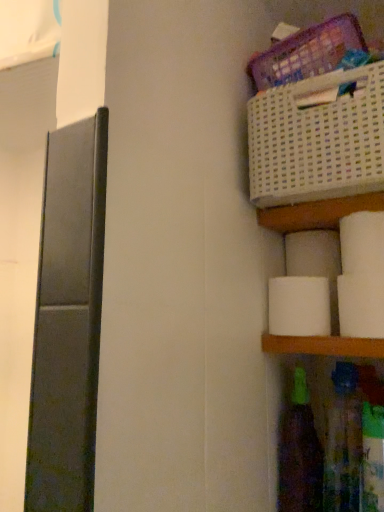
Image resolution: width=384 pixels, height=512 pixels. Describe the element at coordinates (299, 306) in the screenshot. I see `white matte toilet paper at right, marked as the 3th toilet paper in a front-to-back arrangement` at that location.

Locate an element on the screen. The image size is (384, 512). white matte toilet paper at right, the 4th toilet paper from the front is located at coordinates (313, 254).

Locate an element on the screen. This screenshot has height=512, width=384. white plastic basket at upper right is located at coordinates (317, 140).

What do you see at coordinates (317, 140) in the screenshot? I see `white plastic basket at upper right` at bounding box center [317, 140].

Find the location of a particular element. The height and width of the screenshot is (512, 384). translucent plastic bottle at lower right, which is the second bottle from right to left is located at coordinates (299, 452).

Between translucent plastic bottle at lower right, which is the second bottle from right to left, and white matte toilet paper at right, which is counted as the second toilet paper, starting from the back, which one has less height?

white matte toilet paper at right, which is counted as the second toilet paper, starting from the back, is shorter.

From a real-world perspective, which is physically below, translucent plastic bottle at lower right, which is the second bottle from right to left, or white matte toilet paper at right, which is counted as the second toilet paper, starting from the back?

translucent plastic bottle at lower right, which is the second bottle from right to left, from a real-world perspective.

Considering the positions of objects translucent plastic bottle at lower right, which is the second bottle from right to left, and white matte toilet paper at right, marked as the 3th toilet paper in a front-to-back arrangement, in the image provided, who is more to the left, translucent plastic bottle at lower right, which is the second bottle from right to left, or white matte toilet paper at right, marked as the 3th toilet paper in a front-to-back arrangement,?

white matte toilet paper at right, marked as the 3th toilet paper in a front-to-back arrangement.

Is translucent plastic bottle at lower right, which is the second bottle from right to left, positioned with its back to white matte toilet paper at right, which is counted as the second toilet paper, starting from the back?

No, translucent plastic bottle at lower right, which is the second bottle from right to left, is not facing away from white matte toilet paper at right, which is counted as the second toilet paper, starting from the back.

What's the angular difference between white matte toilet paper at lower right, arranged as the first toilet paper when viewed from the front, and translucent plastic bottle at lower right, the first bottle from the right,'s facing directions?

There is a 0.00146-degree angle between the facing directions of white matte toilet paper at lower right, arranged as the first toilet paper when viewed from the front, and translucent plastic bottle at lower right, the first bottle from the right.

Is white matte toilet paper at lower right, the fourth toilet paper positioned from the back, further to camera compared to translucent plastic bottle at lower right, which appears as the 2th bottle when viewed from the left?

No, the depth of white matte toilet paper at lower right, the fourth toilet paper positioned from the back, is less than that of translucent plastic bottle at lower right, which appears as the 2th bottle when viewed from the left.

From the image's perspective, which object appears higher, white matte toilet paper at lower right, arranged as the first toilet paper when viewed from the front, or translucent plastic bottle at lower right, which appears as the 2th bottle when viewed from the left?

From the image's view, white matte toilet paper at lower right, arranged as the first toilet paper when viewed from the front, is above.

Is the surface of white matte toilet paper at lower right, the fourth toilet paper positioned from the back, in direct contact with translucent plastic bottle at lower right, which appears as the 2th bottle when viewed from the left?

No.

Is white matte toilet paper at right, which is the 3th toilet paper from back to front, positioned beyond the bounds of white matte toilet paper at lower right, arranged as the first toilet paper when viewed from the front?

white matte toilet paper at right, which is the 3th toilet paper from back to front, is positioned outside white matte toilet paper at lower right, arranged as the first toilet paper when viewed from the front.

From a real-world perspective, who is located lower, white matte toilet paper at right, which is counted as the 2th toilet paper, starting from the front, or white matte toilet paper at lower right, arranged as the first toilet paper when viewed from the front?

white matte toilet paper at lower right, arranged as the first toilet paper when viewed from the front.

Does white matte toilet paper at right, which is the 3th toilet paper from back to front, lie behind white matte toilet paper at lower right, the fourth toilet paper positioned from the back?

That is True.

Can you tell me how much white matte toilet paper at right, the 4th toilet paper from the front, and white matte toilet paper at right, marked as the 3th toilet paper in a front-to-back arrangement, differ in facing direction?

white matte toilet paper at right, the 4th toilet paper from the front, and white matte toilet paper at right, marked as the 3th toilet paper in a front-to-back arrangement, are facing 0.000574 degrees away from each other.

From a real-world perspective, is white matte toilet paper at right, the 4th toilet paper from the front, on top of white matte toilet paper at right, which is counted as the second toilet paper, starting from the back?

Yes, from a real-world perspective, white matte toilet paper at right, the 4th toilet paper from the front, is over white matte toilet paper at right, which is counted as the second toilet paper, starting from the back

Is white matte toilet paper at right, marked as the 3th toilet paper in a front-to-back arrangement, a part of white matte toilet paper at right, the 4th toilet paper from the front?

No, white matte toilet paper at right, marked as the 3th toilet paper in a front-to-back arrangement, is not surrounded by white matte toilet paper at right, the 4th toilet paper from the front.

Which object is wider, white matte toilet paper at right, which ranks as the first toilet paper in back-to-front order, or white matte toilet paper at right, which is counted as the second toilet paper, starting from the back?

Wider between the two is white matte toilet paper at right, which ranks as the first toilet paper in back-to-front order.

Does white matte toilet paper at right, which is counted as the second toilet paper, starting from the back, appear on the left side of translucent plastic bottle at lower right, which appears as the 2th bottle when viewed from the left?

Answer: Yes, white matte toilet paper at right, which is counted as the second toilet paper, starting from the back, is to the left of translucent plastic bottle at lower right, which appears as the 2th bottle when viewed from the left.

Which is behind, white matte toilet paper at right, marked as the 3th toilet paper in a front-to-back arrangement, or translucent plastic bottle at lower right, which appears as the 2th bottle when viewed from the left?

white matte toilet paper at right, marked as the 3th toilet paper in a front-to-back arrangement, is more distant.

From a real-world perspective, is white matte toilet paper at right, which is counted as the second toilet paper, starting from the back, positioned above or below translucent plastic bottle at lower right, the first bottle from the right?

white matte toilet paper at right, which is counted as the second toilet paper, starting from the back, is situated higher than translucent plastic bottle at lower right, the first bottle from the right, in the real world.

Which point is more distant from viewer, (277, 311) or (356, 482)?

Point (277, 311)

Is white plastic basket at upper right oriented towards translucent plastic bottle at lower right, the first bottle from the right?

No, white plastic basket at upper right is not turned towards translucent plastic bottle at lower right, the first bottle from the right.

Can you confirm if white plastic basket at upper right is shorter than translucent plastic bottle at lower right, the first bottle from the right?

Correct, white plastic basket at upper right is not as tall as translucent plastic bottle at lower right, the first bottle from the right.

Is white plastic basket at upper right positioned before translucent plastic bottle at lower right, the first bottle from the right?

Yes, white plastic basket at upper right is in front of translucent plastic bottle at lower right, the first bottle from the right.

Can you confirm if white plastic basket at upper right is positioned to the left of translucent plastic bottle at lower right, which appears as the 2th bottle when viewed from the left?

Yes, white plastic basket at upper right is to the left of translucent plastic bottle at lower right, which appears as the 2th bottle when viewed from the left.

Can you confirm if white matte toilet paper at right, which is counted as the second toilet paper, starting from the back, is thinner than white matte toilet paper at lower right, the fourth toilet paper positioned from the back?

No, white matte toilet paper at right, which is counted as the second toilet paper, starting from the back, is not thinner than white matte toilet paper at lower right, the fourth toilet paper positioned from the back.

From the image's perspective, which one is positioned lower, white matte toilet paper at right, which is counted as the second toilet paper, starting from the back, or white matte toilet paper at lower right, arranged as the first toilet paper when viewed from the front?

white matte toilet paper at right, which is counted as the second toilet paper, starting from the back, appears lower in the image.

Considering the sizes of objects white matte toilet paper at right, which is counted as the second toilet paper, starting from the back, and white matte toilet paper at lower right, arranged as the first toilet paper when viewed from the front, in the image provided, who is smaller, white matte toilet paper at right, which is counted as the second toilet paper, starting from the back, or white matte toilet paper at lower right, arranged as the first toilet paper when viewed from the front,?

With smaller size is white matte toilet paper at lower right, arranged as the first toilet paper when viewed from the front.

Can you confirm if white matte toilet paper at right, marked as the 3th toilet paper in a front-to-back arrangement, is taller than white matte toilet paper at lower right, arranged as the first toilet paper when viewed from the front?

In fact, white matte toilet paper at right, marked as the 3th toilet paper in a front-to-back arrangement, may be shorter than white matte toilet paper at lower right, arranged as the first toilet paper when viewed from the front.

This screenshot has height=512, width=384. I want to click on the 2nd bottle below the white matte toilet paper at right, marked as the 3th toilet paper in a front-to-back arrangement (from the image's perspective), so click(299, 452).

The width and height of the screenshot is (384, 512). I want to click on the 2nd toilet paper positioned above the translucent plastic bottle at lower right, the first bottle from the right (from the image's perspective), so 361,305.

Looking at the image, which one is located closer to translucent plastic bottle at lower right, which appears as the 2th bottle when viewed from the left, white matte toilet paper at right, marked as the 3th toilet paper in a front-to-back arrangement, or white matte toilet paper at right, the 4th toilet paper from the front?

The object closer to translucent plastic bottle at lower right, which appears as the 2th bottle when viewed from the left, is white matte toilet paper at right, marked as the 3th toilet paper in a front-to-back arrangement.

Estimate the real-world distances between objects in this image. Which object is further from translucent plastic bottle at lower right, the first bottle in the left-to-right sequence, translucent plastic bottle at lower right, which appears as the 2th bottle when viewed from the left, or white matte toilet paper at right, which is counted as the 2th toilet paper, starting from the front?

white matte toilet paper at right, which is counted as the 2th toilet paper, starting from the front, is positioned further to the anchor translucent plastic bottle at lower right, the first bottle in the left-to-right sequence.

From the image, which object appears to be farther from translucent plastic bottle at lower right, the first bottle from the right, white plastic basket at upper right or translucent plastic bottle at lower right, the first bottle in the left-to-right sequence?

white plastic basket at upper right lies further to translucent plastic bottle at lower right, the first bottle from the right, than the other object.

Based on their spatial positions, is translucent plastic bottle at lower right, which appears as the 2th bottle when viewed from the left, or white matte toilet paper at right, which ranks as the first toilet paper in back-to-front order, closer to white plastic basket at upper right?

white matte toilet paper at right, which ranks as the first toilet paper in back-to-front order, lies closer to white plastic basket at upper right than the other object.

Considering their positions, is white matte toilet paper at right, which ranks as the first toilet paper in back-to-front order, positioned further to white matte toilet paper at right, marked as the 3th toilet paper in a front-to-back arrangement, than translucent plastic bottle at lower right, the first bottle in the left-to-right sequence?

translucent plastic bottle at lower right, the first bottle in the left-to-right sequence, lies further to white matte toilet paper at right, marked as the 3th toilet paper in a front-to-back arrangement, than the other object.

Considering their positions, is translucent plastic bottle at lower right, which appears as the 2th bottle when viewed from the left, positioned closer to white matte toilet paper at right, which is counted as the second toilet paper, starting from the back, than white matte toilet paper at right, which is counted as the 2th toilet paper, starting from the front?

white matte toilet paper at right, which is counted as the 2th toilet paper, starting from the front, is closer to white matte toilet paper at right, which is counted as the second toilet paper, starting from the back.

Estimate the real-world distances between objects in this image. Which object is further from white plastic basket at upper right, white matte toilet paper at right, which is the 3th toilet paper from back to front, or white matte toilet paper at right, marked as the 3th toilet paper in a front-to-back arrangement?

white matte toilet paper at right, marked as the 3th toilet paper in a front-to-back arrangement.

Looking at the image, which one is located closer to white matte toilet paper at right, which is counted as the second toilet paper, starting from the back, translucent plastic bottle at lower right, which is the second bottle from right to left, or white matte toilet paper at lower right, the fourth toilet paper positioned from the back?

white matte toilet paper at lower right, the fourth toilet paper positioned from the back, lies closer to white matte toilet paper at right, which is counted as the second toilet paper, starting from the back, than the other object.

Where is `bottle between white matte toilet paper at right, which is counted as the 2th toilet paper, starting from the front, and translucent plastic bottle at lower right, the first bottle in the left-to-right sequence, from top to bottom`? The height and width of the screenshot is (512, 384). bottle between white matte toilet paper at right, which is counted as the 2th toilet paper, starting from the front, and translucent plastic bottle at lower right, the first bottle in the left-to-right sequence, from top to bottom is located at coordinates (343, 441).

The width and height of the screenshot is (384, 512). What are the coordinates of `bottle between white matte toilet paper at right, marked as the 3th toilet paper in a front-to-back arrangement, and translucent plastic bottle at lower right, the first bottle in the left-to-right sequence, in the vertical direction` in the screenshot? It's located at (343, 441).

Where is `bottle between white matte toilet paper at right, the 4th toilet paper from the front, and translucent plastic bottle at lower right, the first bottle in the left-to-right sequence, in the up-down direction`? bottle between white matte toilet paper at right, the 4th toilet paper from the front, and translucent plastic bottle at lower right, the first bottle in the left-to-right sequence, in the up-down direction is located at coordinates (x=343, y=441).

What are the coordinates of `toilet paper between white matte toilet paper at lower right, the fourth toilet paper positioned from the back, and translucent plastic bottle at lower right, the first bottle from the right, from top to bottom` in the screenshot? It's located at (299, 306).